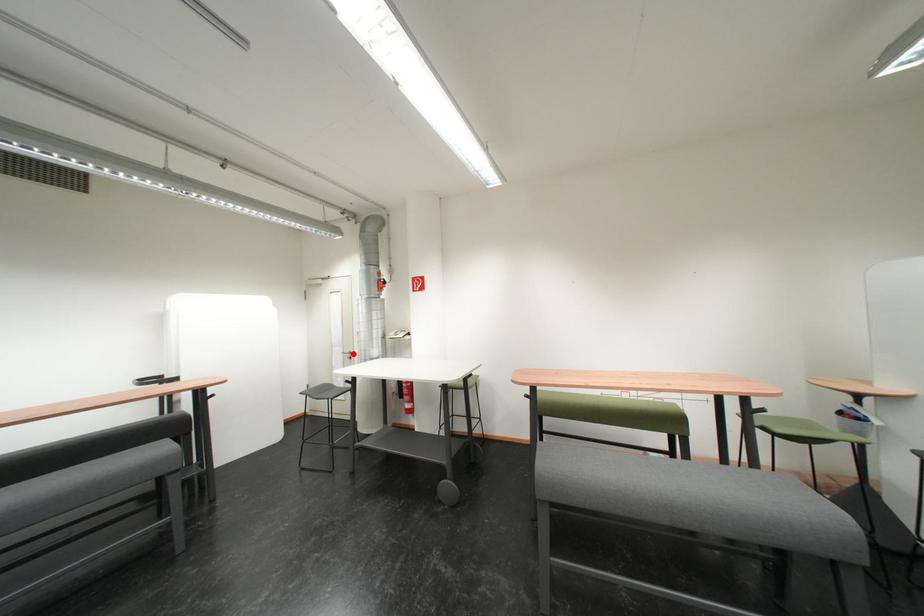
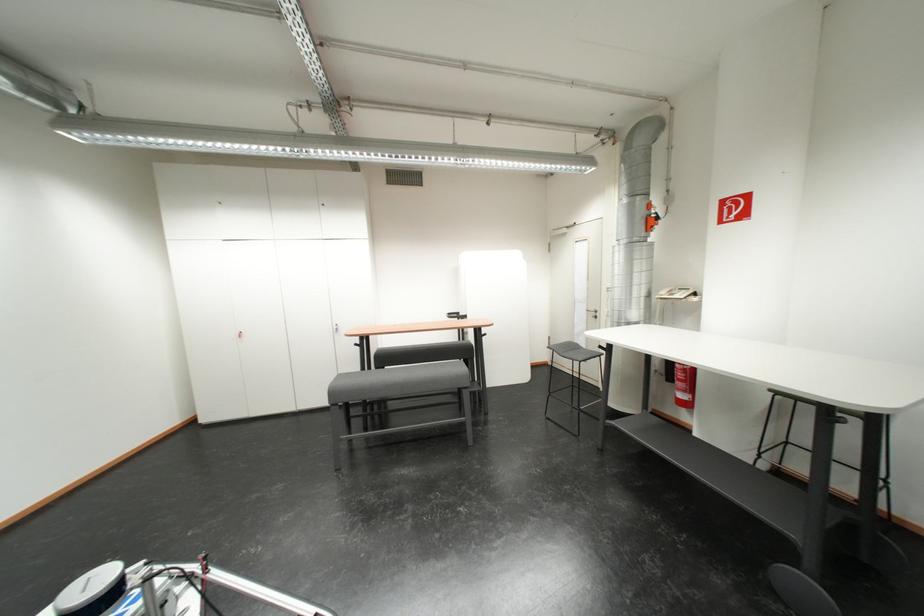
Question: I am providing you with two images of the same scene from different viewpoints. Given a red point in image1, look at the same physical point in image2. Is it:

Choices:
 (A) Closer to the viewpoint
 (B) Farther from the viewpoint

Answer: (A)